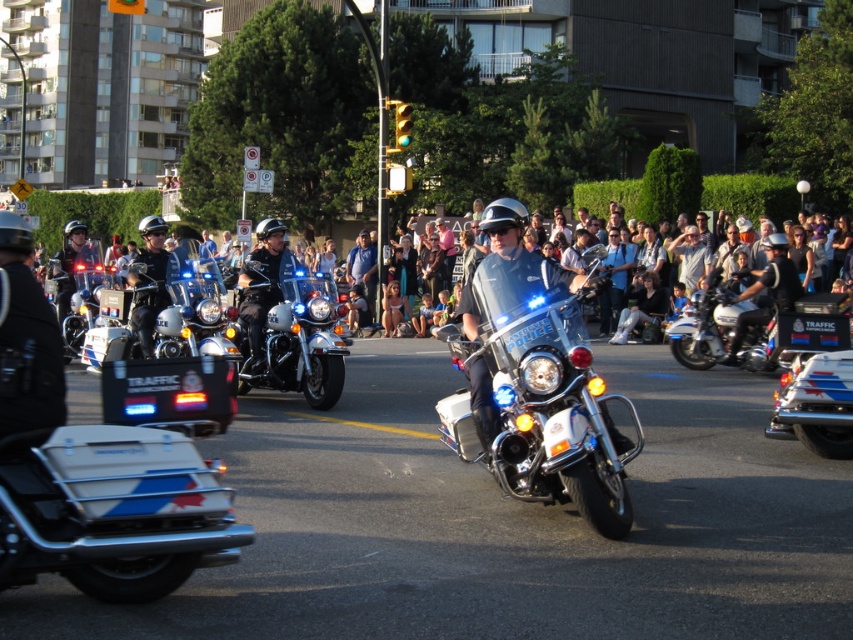
Who is taller, polished chrome motorcycle at center or metallic silver helmet at center?

polished chrome motorcycle at center

Is polished chrome motorcycle at center positioned in front of metallic silver helmet at center?

Yes.

Is point (236, 346) farther from camera compared to point (759, 288)?

No, (236, 346) is in front of (759, 288).

Identify the location of polished chrome motorcycle at center. The height and width of the screenshot is (640, 853). (294, 336).

Which of these two, metallic blue motorcycle at center or white glossy police motorcycle at center, stands shorter?

With less height is metallic blue motorcycle at center.

In the scene shown: Is metallic blue motorcycle at center shorter than white glossy police motorcycle at center?

Correct, metallic blue motorcycle at center is not as tall as white glossy police motorcycle at center.

Between point (804, 422) and point (85, 257), which one is positioned behind?

Point (85, 257)

Image resolution: width=853 pixels, height=640 pixels. Find the location of `metallic blue motorcycle at center`. metallic blue motorcycle at center is located at coordinates (817, 378).

Does glossy white motorcycle at center lie in front of white glossy police motorcycle at center?

Yes, it is in front of white glossy police motorcycle at center.

Can you confirm if glossy white motorcycle at center is positioned above white glossy police motorcycle at center?

Actually, glossy white motorcycle at center is below white glossy police motorcycle at center.

The height and width of the screenshot is (640, 853). Identify the location of glossy white motorcycle at center. (541, 396).